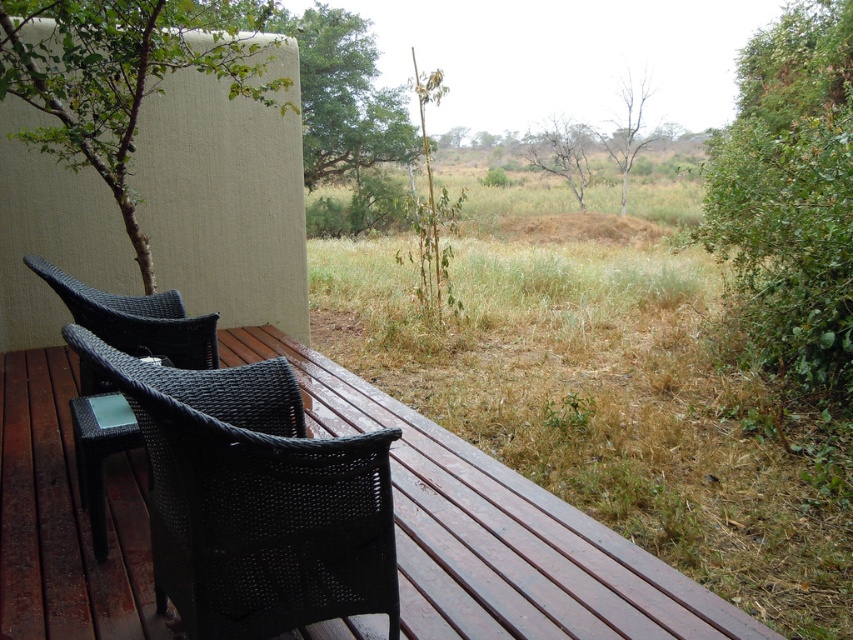
Question: Can you confirm if brown rough tree at center is smaller than bare branches at center?

Choices:
 (A) yes
 (B) no

Answer: (B)

Question: Does green leafy bush at right appear on the right side of green leafy tree at upper center?

Choices:
 (A) no
 (B) yes

Answer: (B)

Question: Which of the following is the closest to the observer?

Choices:
 (A) (369, 115)
 (B) (579, 148)
 (C) (538, 390)
 (D) (621, 179)

Answer: (C)

Question: Is dry grass at center to the right of brown rough tree at center from the viewer's perspective?

Choices:
 (A) yes
 (B) no

Answer: (B)

Question: Which object is positioned closest to the green leafy tree at upper center?

Choices:
 (A) green leafy bush at right
 (B) black wicker chair at left
 (C) brown rough tree at center
 (D) black wicker chair at lower left

Answer: (C)

Question: Which of the following is the closest to the observer?

Choices:
 (A) (254, 612)
 (B) (515, 518)
 (C) (584, 179)

Answer: (A)